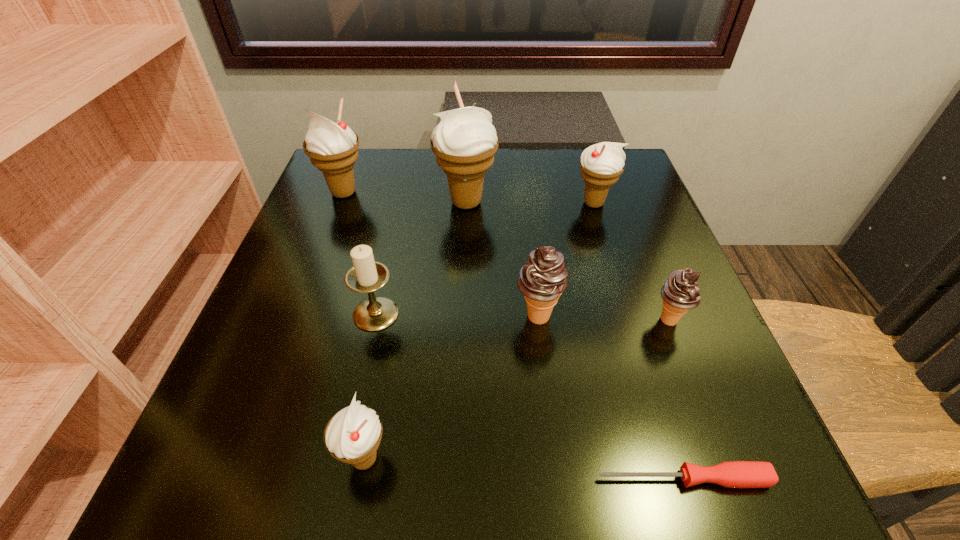
Locate an element on the screen. free space located at the tip of the screwdriver is located at coordinates (412, 478).

Find the location of a particular element. The height and width of the screenshot is (540, 960). free region located 0.060m at the tip of the screwdriver is located at coordinates (551, 478).

I want to click on icecream located in the near edge section of the desktop, so click(352, 435).

Locate an element on the screen. The image size is (960, 540). screwdriver at the near edge is located at coordinates (735, 474).

In order to click on object that is at the left edge in this screenshot , I will do 332,147.

Find the location of a particular element. This screenshot has width=960, height=540. screwdriver that is at the right edge is located at coordinates (735, 474).

Locate an element on the screen. The height and width of the screenshot is (540, 960). object located at the far left corner is located at coordinates (332, 147).

This screenshot has height=540, width=960. I want to click on object situated at the far right corner, so click(601, 164).

Find the location of a particular element. This screenshot has height=540, width=960. object present at the near right corner is located at coordinates (735, 474).

Find the location of a particular element. vacant area at the far edge is located at coordinates coord(514,184).